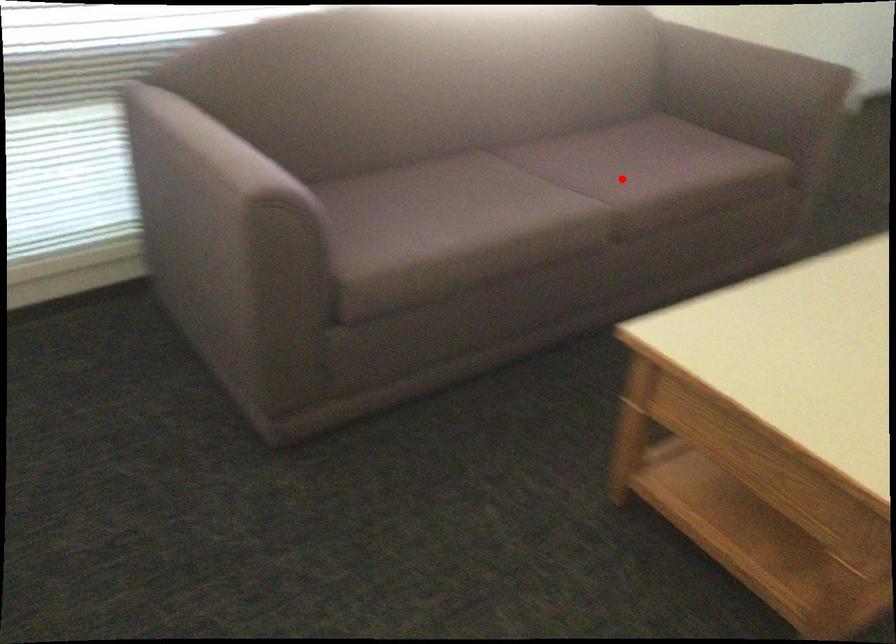
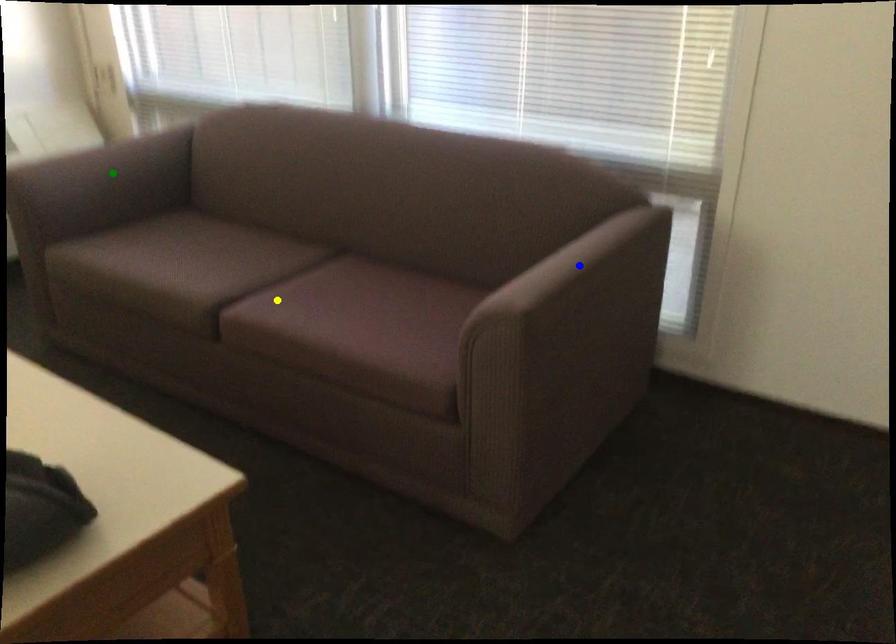
Question: I am providing you with two images of the same scene from different viewpoints. A red point is marked on the first image. You are given multiple points on the second image. In image 2, which mark is for the same physical point as the one in image 1?

Choices:
 (A) green point
 (B) yellow point
 (C) blue point

Answer: (B)